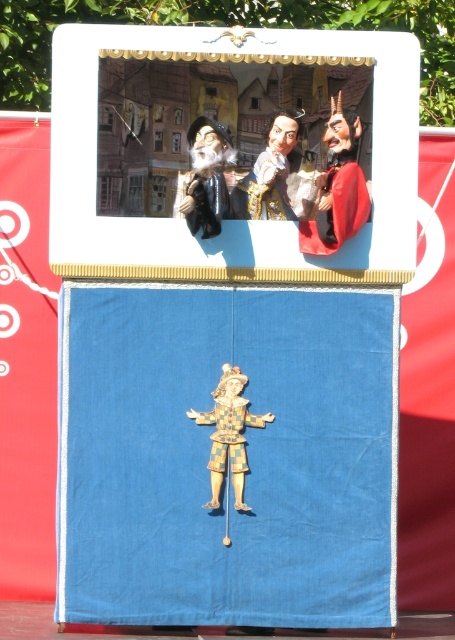
You are an audience member sitting in front of the puppet show stage. You notice two items on the stage setup. The first is the wooden clown at center, and the second is the smooth leather mask at upper center. Which of these two items is positioned higher up on the stage?

The smooth leather mask at upper center is positioned higher up on the stage than the wooden clown at center.

You are a stagehand preparing to adjust the height of the blue fabric puppet at center and the smooth leather mask at upper center. Based on their sizes, which object should you adjust first if you need to ensure both are visible to the audience?

The blue fabric puppet at center is taller than the smooth leather mask at upper center, so you should adjust the smooth leather mask at upper center first to ensure it is visible over the blue fabric puppet at center.

You are a photographer adjusting your camera to focus on two points in the image. The first point is at coordinate point(121, 333) and the second is at point(237, 204). Which point should you focus on first if you want to capture the closest object to the camera?

Point(121, 333) is closer to the camera than point(237, 204), so you should focus on point(121, 333) first to capture the closest object.